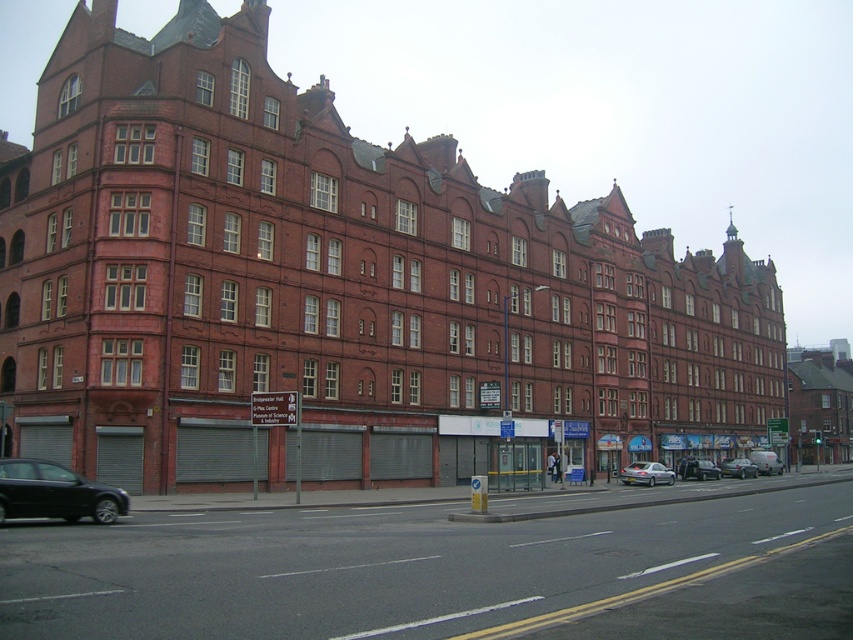
Question: Which point appears farthest from the camera in this image?

Choices:
 (A) click(x=51, y=476)
 (B) click(x=648, y=481)
 (C) click(x=727, y=461)
 (D) click(x=699, y=476)

Answer: (C)

Question: Does shiny black sedan at lower left appear over silver metallic car at center?

Choices:
 (A) no
 (B) yes

Answer: (B)

Question: Which point is farther to the camera?

Choices:
 (A) silver metallic van at center
 (B) white matte van at center-right

Answer: (B)

Question: Does white matte van at center-right have a greater width compared to silver metallic van at center?

Choices:
 (A) yes
 (B) no

Answer: (A)

Question: From the image, what is the correct spatial relationship of silver metallic sedan at center in relation to white matte van at center-right?

Choices:
 (A) right
 (B) left

Answer: (B)

Question: Which object is farther from the camera taking this photo?

Choices:
 (A) silver metallic sedan at center
 (B) silver metallic van at center

Answer: (B)